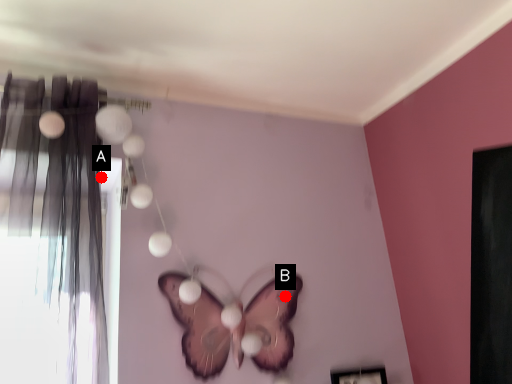
Question: Two points are circled on the image, labeled by A and B beside each circle. Which of the following is the closest to the observer?

Choices:
 (A) A is closer
 (B) B is closer

Answer: (A)